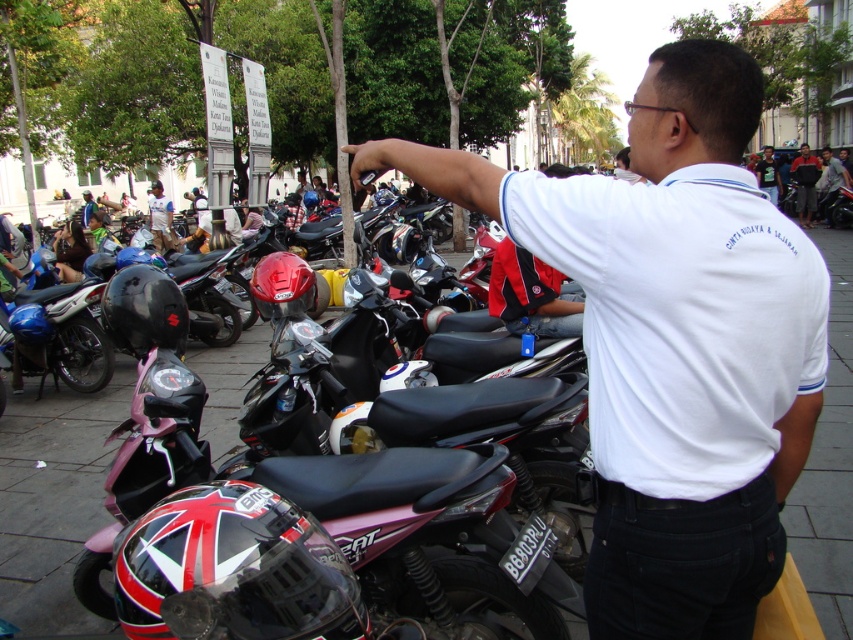
In the scene shown: You are a delivery person trying to navigate through the parking area. There is a light gray fabric shirt at center and a white shirt at upper center in your path. Can you pass between them without needing to move either? The minimum space required for your delivery cart is 6 feet.

The distance between the light gray fabric shirt at center and the white shirt at upper center is 5.93 feet, which is slightly less than the required 6 feet for your delivery cart. Therefore, you cannot pass between them without moving at least one of them.